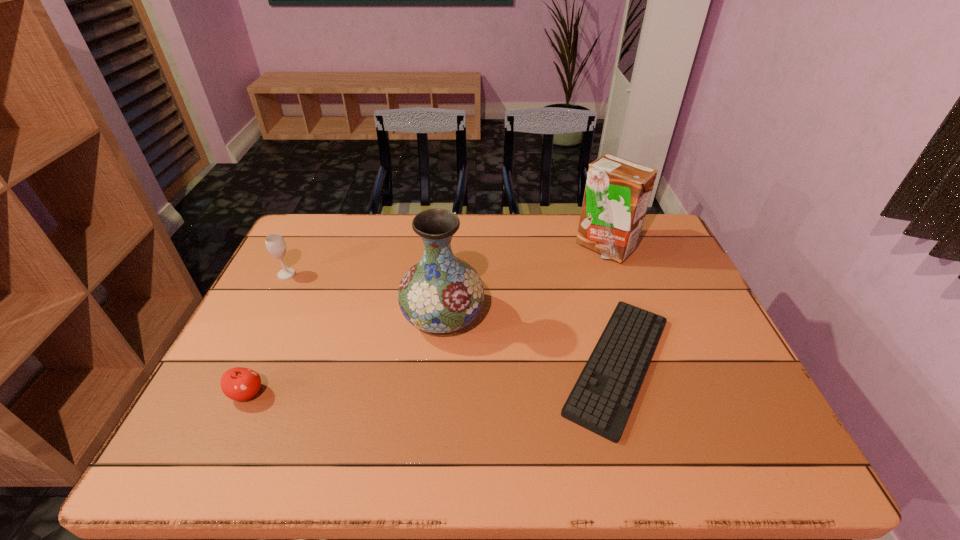
Where is `the third closest object to the third shortest object`? The height and width of the screenshot is (540, 960). the third closest object to the third shortest object is located at coordinates (601, 400).

Locate which object ranks fourth in proximity to the apple. Please provide its 2D coordinates. Your answer should be formatted as a tuple, i.e. [(x, y)], where the tuple contains the x and y coordinates of a point satisfying the conditions above.

[(617, 193)]

Locate an element on the screen. The width and height of the screenshot is (960, 540). blank space that satisfies the following two spatial constraints: 1. on the back side of the computer keyboard; 2. on the right side of the fourth tallest object is located at coordinates (260, 364).

Find the location of a particular element. vacant region that satisfies the following two spatial constraints: 1. on the back side of the shortest object; 2. on the left side of the apple is located at coordinates (260, 364).

The height and width of the screenshot is (540, 960). In order to click on free location that satisfies the following two spatial constraints: 1. on the front side of the shortest object; 2. on the left side of the wineglass in this screenshot , I will do `click(241, 364)`.